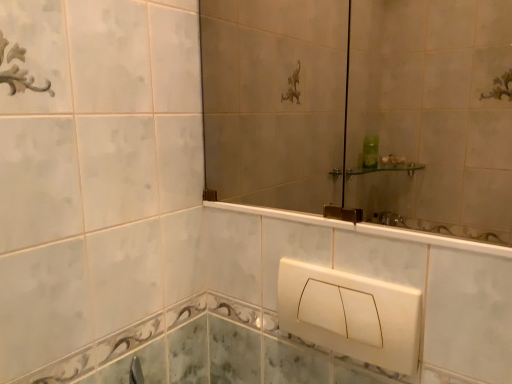
Image resolution: width=512 pixels, height=384 pixels. Describe the element at coordinates (362, 110) in the screenshot. I see `matte glass mirror at upper center` at that location.

Where is `matte glass mirror at upper center`? This screenshot has height=384, width=512. matte glass mirror at upper center is located at coordinates click(362, 110).

Where is `white plastic toilet cover at lower center`? The width and height of the screenshot is (512, 384). white plastic toilet cover at lower center is located at coordinates (351, 314).

Describe the element at coordinates (351, 314) in the screenshot. The width and height of the screenshot is (512, 384). I see `white plastic toilet cover at lower center` at that location.

Where is `matte glass mirror at upper center`? The image size is (512, 384). matte glass mirror at upper center is located at coordinates (362, 110).

Which object is positioned more to the right, matte glass mirror at upper center or white plastic toilet cover at lower center?

From the viewer's perspective, white plastic toilet cover at lower center appears more on the right side.

Considering the positions of objects matte glass mirror at upper center and white plastic toilet cover at lower center in the image provided, who is in front, matte glass mirror at upper center or white plastic toilet cover at lower center?

matte glass mirror at upper center is more forward.

Is point (319, 135) positioned in front of point (323, 305)?

No, it is behind (323, 305).

From the image's perspective, is matte glass mirror at upper center on top of white plastic toilet cover at lower center?

Yes, from the image's perspective, matte glass mirror at upper center is on top of white plastic toilet cover at lower center.

From a real-world perspective, is matte glass mirror at upper center positioned above or below white plastic toilet cover at lower center?

From a real-world perspective, matte glass mirror at upper center is physically above white plastic toilet cover at lower center.

Which of these two, matte glass mirror at upper center or white plastic toilet cover at lower center, is wider?

With larger width is white plastic toilet cover at lower center.

Considering the sizes of objects matte glass mirror at upper center and white plastic toilet cover at lower center in the image provided, who is taller, matte glass mirror at upper center or white plastic toilet cover at lower center?

matte glass mirror at upper center.

Considering the relative sizes of matte glass mirror at upper center and white plastic toilet cover at lower center in the image provided, is matte glass mirror at upper center smaller than white plastic toilet cover at lower center?

No.

Is matte glass mirror at upper center completely or partially outside of white plastic toilet cover at lower center?

Absolutely, matte glass mirror at upper center is external to white plastic toilet cover at lower center.

Are matte glass mirror at upper center and white plastic toilet cover at lower center far apart?

matte glass mirror at upper center is actually quite close to white plastic toilet cover at lower center.

Is matte glass mirror at upper center positioned with its back to white plastic toilet cover at lower center?

No, matte glass mirror at upper center is not facing away from white plastic toilet cover at lower center.

How different are the orientations of matte glass mirror at upper center and white plastic toilet cover at lower center in degrees?

There is a 0.323-degree angle between the facing directions of matte glass mirror at upper center and white plastic toilet cover at lower center.

Measure the distance from matte glass mirror at upper center to white plastic toilet cover at lower center.

matte glass mirror at upper center is 33.02 inches away from white plastic toilet cover at lower center.

Where is `mirror that appears above the white plastic toilet cover at lower center (from the image's perspective)`? Image resolution: width=512 pixels, height=384 pixels. mirror that appears above the white plastic toilet cover at lower center (from the image's perspective) is located at coordinates (362, 110).

From the picture: In the image, is white plastic toilet cover at lower center on the left side or the right side of matte glass mirror at upper center?

In the image, white plastic toilet cover at lower center appears on the right side of matte glass mirror at upper center.

Considering the positions of objects white plastic toilet cover at lower center and matte glass mirror at upper center in the image provided, who is in front, white plastic toilet cover at lower center or matte glass mirror at upper center?

matte glass mirror at upper center is more forward.

Considering the positions of points (297, 305) and (350, 175), is point (297, 305) closer to camera compared to point (350, 175)?

Yes.

From the image's perspective, does white plastic toilet cover at lower center appear higher than matte glass mirror at upper center?

No.

Consider the image. From a real-world perspective, is white plastic toilet cover at lower center physically located above or below matte glass mirror at upper center?

Clearly, from a real-world perspective, white plastic toilet cover at lower center is below matte glass mirror at upper center.

Is white plastic toilet cover at lower center wider than matte glass mirror at upper center?

Yes.

Which of these two, white plastic toilet cover at lower center or matte glass mirror at upper center, stands taller?

matte glass mirror at upper center.

Can you confirm if white plastic toilet cover at lower center is smaller than matte glass mirror at upper center?

Correct, white plastic toilet cover at lower center occupies less space than matte glass mirror at upper center.

Would you say white plastic toilet cover at lower center is outside matte glass mirror at upper center?

Absolutely, white plastic toilet cover at lower center is external to matte glass mirror at upper center.

Are white plastic toilet cover at lower center and matte glass mirror at upper center making contact?

No, white plastic toilet cover at lower center is not with matte glass mirror at upper center.

Is white plastic toilet cover at lower center facing towards matte glass mirror at upper center?

No.

How many degrees apart are the facing directions of white plastic toilet cover at lower center and matte glass mirror at upper center?

0.323 degrees separate the facing orientations of white plastic toilet cover at lower center and matte glass mirror at upper center.

What are the coordinates of `square behind the matte glass mirror at upper center` in the screenshot? It's located at (351, 314).

This screenshot has width=512, height=384. I want to click on mirror above the white plastic toilet cover at lower center (from the image's perspective), so click(x=362, y=110).

Locate an element on the screen. This screenshot has height=384, width=512. mirror that is in front of the white plastic toilet cover at lower center is located at coordinates (362, 110).